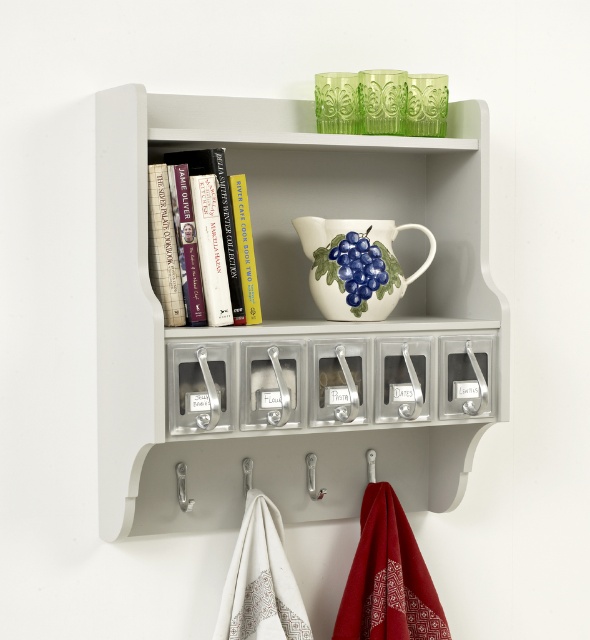
Find the location of `white matte bookshelf at upper center`. white matte bookshelf at upper center is located at coordinates (286, 310).

Can you confirm if white matte bookshelf at upper center is positioned above hardcover books at upper left?

Incorrect, white matte bookshelf at upper center is not positioned above hardcover books at upper left.

This screenshot has width=590, height=640. What do you see at coordinates (286, 310) in the screenshot?
I see `white matte bookshelf at upper center` at bounding box center [286, 310].

The height and width of the screenshot is (640, 590). I want to click on white matte bookshelf at upper center, so pyautogui.click(x=286, y=310).

Who is more forward, (391, 337) or (316, 250)?

Point (391, 337) is in front.

Is point (129, 312) positioned in front of point (335, 253)?

That is True.

What do you see at coordinates (286, 310) in the screenshot?
I see `white matte bookshelf at upper center` at bounding box center [286, 310].

I want to click on white matte bookshelf at upper center, so click(x=286, y=310).

Can you confirm if hardcover books at upper left is positioned to the right of silver metallic hook at lower left?

Indeed, hardcover books at upper left is positioned on the right side of silver metallic hook at lower left.

Between point (231, 280) and point (178, 461), which one is positioned behind?

Positioned behind is point (178, 461).

Which is behind, point (221, 225) or point (181, 467)?

Point (181, 467)

Locate an element on the screen. The width and height of the screenshot is (590, 640). hardcover books at upper left is located at coordinates (221, 221).